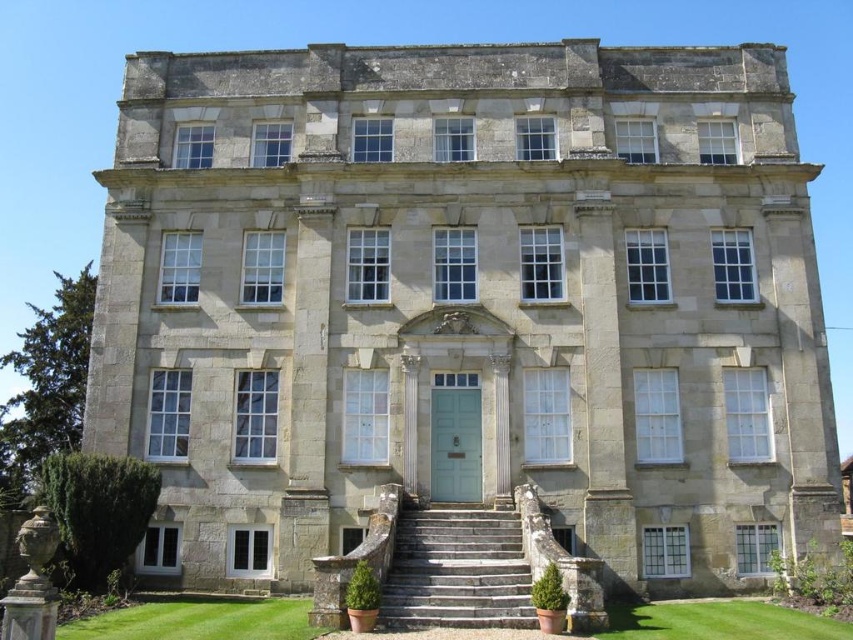
You are standing at the front of the grand building and looking towards the entrance. Which area of green grass is closer to you, the green grass at lower center or the green grass at lower right?

The green grass at lower center is closer to you because it is located below the green grass at lower right, meaning it is positioned in front of it from your viewpoint.